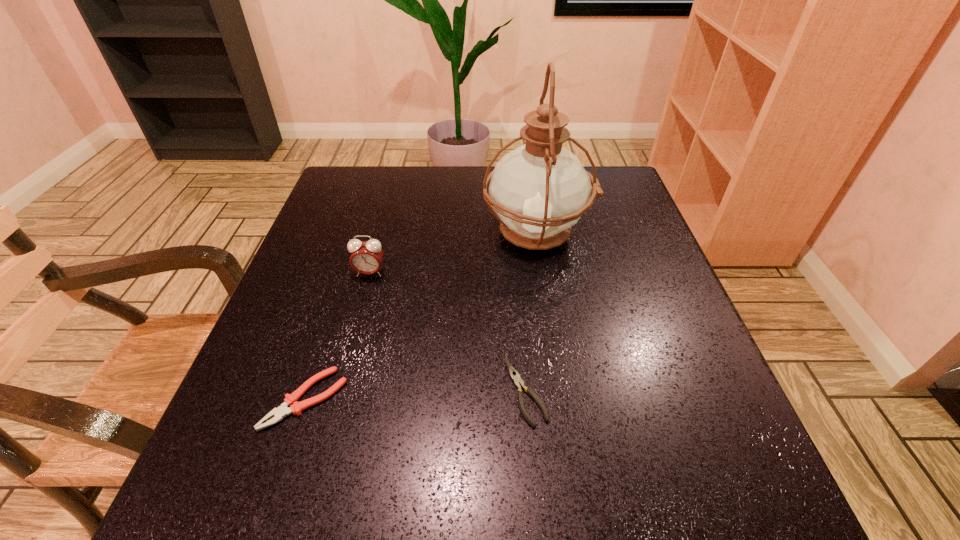
Where is `free space between the right pliers and the tallest object`? Image resolution: width=960 pixels, height=540 pixels. free space between the right pliers and the tallest object is located at coordinates (531, 313).

Where is `vacant space that is in between the right pliers and the tallest object`? Image resolution: width=960 pixels, height=540 pixels. vacant space that is in between the right pliers and the tallest object is located at coordinates (531, 313).

Where is `blank region between the left pliers and the tallest object`? Image resolution: width=960 pixels, height=540 pixels. blank region between the left pliers and the tallest object is located at coordinates (421, 316).

Find the location of a particular element. The width and height of the screenshot is (960, 540). free space between the left pliers and the tallest object is located at coordinates (421, 316).

The height and width of the screenshot is (540, 960). Identify the location of empty space that is in between the left pliers and the tallest object. (421, 316).

The image size is (960, 540). What are the coordinates of `vacant space that's between the right pliers and the oil lamp` in the screenshot? It's located at (531, 313).

I want to click on unoccupied area between the third shortest object and the right pliers, so click(447, 332).

At what (x,y) coordinates should I click in order to perform the action: click on free space between the left pliers and the oil lamp. Please return your answer as a coordinate pair (x, y). Looking at the image, I should click on (421, 316).

Locate an element on the screen. Image resolution: width=960 pixels, height=540 pixels. vacant area that lies between the oil lamp and the alarm clock is located at coordinates (453, 253).

Point out which object is positioned as the third nearest to the right pliers. Please provide its 2D coordinates. Your answer should be formatted as a tuple, i.e. [(x, y)], where the tuple contains the x and y coordinates of a point satisfying the conditions above.

[(366, 258)]